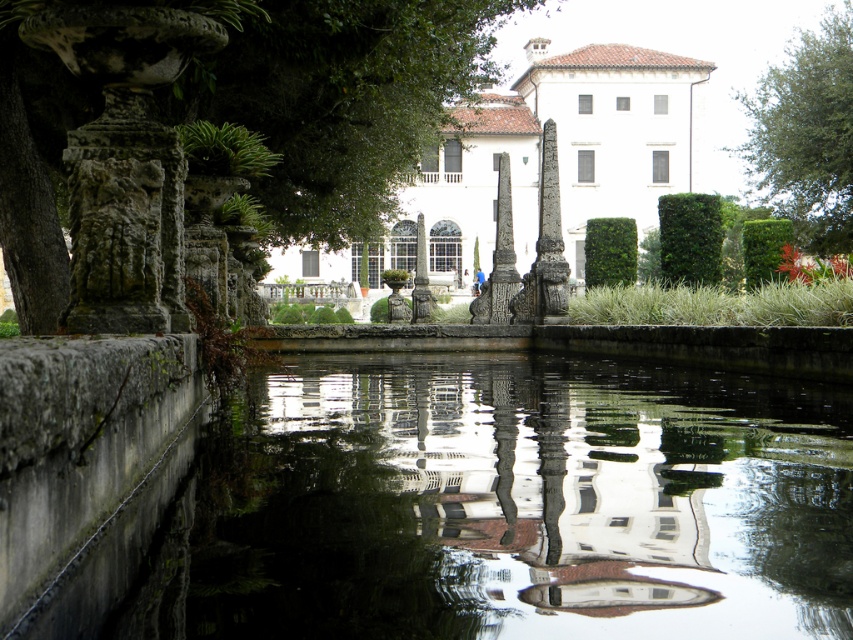
Is smooth concrete water at center bigger than green leafy tree at upper right?

Incorrect, smooth concrete water at center is not larger than green leafy tree at upper right.

You are a GUI agent. You are given a task and a screenshot of the screen. Output one action in this format:
    pyautogui.click(x=<x>, y=<y>)
    Task: Click on the smooth concrete water at center
    The image size is (853, 640).
    Given the screenshot: What is the action you would take?
    pyautogui.click(x=485, y=508)

Does smooth concrete water at center have a greater width compared to green leafy tree at left?

No, smooth concrete water at center is not wider than green leafy tree at left.

Which of these two, smooth concrete water at center or green leafy tree at left, stands taller?

green leafy tree at left is taller.

Locate an element on the screen. smooth concrete water at center is located at coordinates (485, 508).

Find the location of a particular element. Image resolution: width=853 pixels, height=640 pixels. smooth concrete water at center is located at coordinates (485, 508).

Between point (209, 6) and point (776, 177), which one is positioned behind?

The point (776, 177) is behind.

Between point (320, 141) and point (776, 156), which one is positioned in front?

Point (320, 141) is more forward.

You are a GUI agent. You are given a task and a screenshot of the screen. Output one action in this format:
    pyautogui.click(x=<x>, y=<y>)
    Task: Click on the green leafy tree at left
    This screenshot has height=640, width=853.
    Given the screenshot: What is the action you would take?
    pyautogui.click(x=251, y=113)